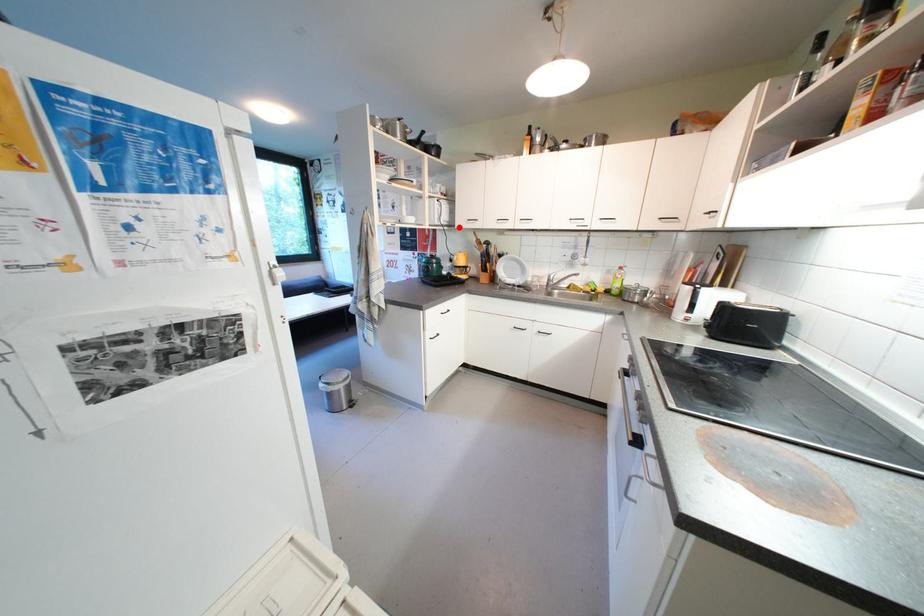
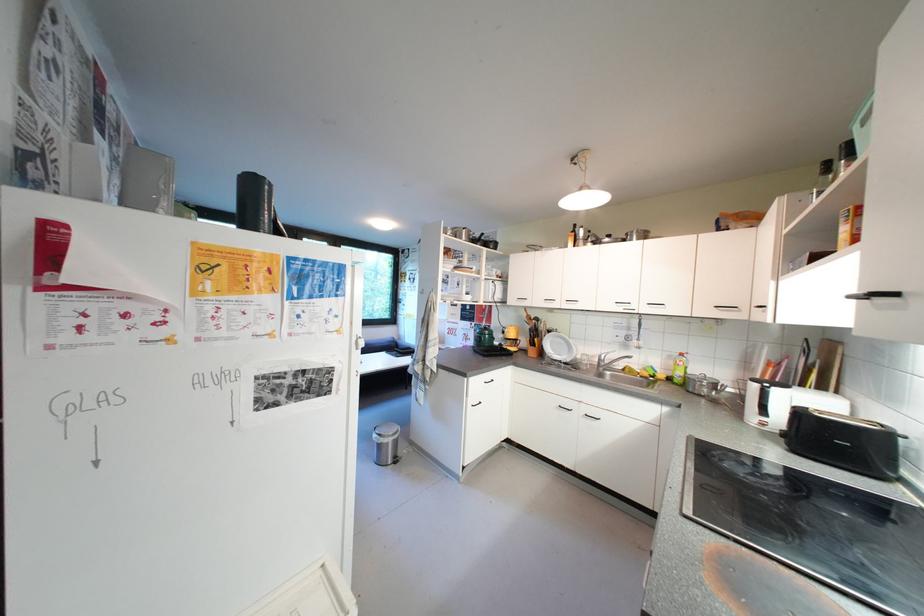
Question: I am providing you with two images of the same scene from different viewpoints. A red point is shown in image1. For the corresponding object point in image2, is it positioned nearer or farther from the camera?

Choices:
 (A) Nearer
 (B) Farther

Answer: (B)